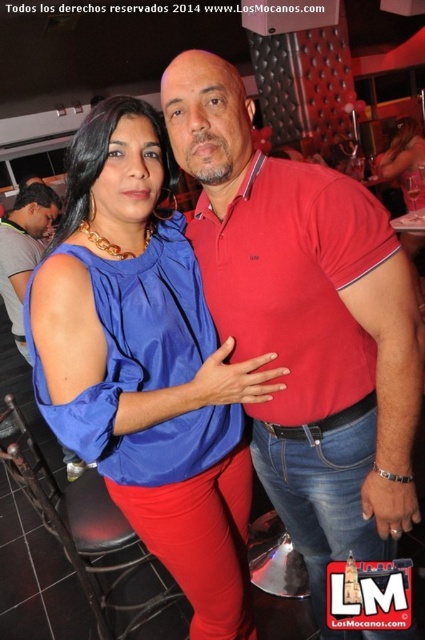
Question: Which point appears closest to the camera in this image?

Choices:
 (A) pyautogui.click(x=274, y=179)
 (B) pyautogui.click(x=192, y=525)
 (C) pyautogui.click(x=17, y=326)

Answer: (A)

Question: Can you confirm if red cotton polo shirt at center is bigger than blue satin blouse at center?

Choices:
 (A) yes
 (B) no

Answer: (A)

Question: Which of these objects is positioned closest to the gray fabric shirt at left?

Choices:
 (A) blue satin blouse at center
 (B) matte blue shirt at center
 (C) red cotton polo shirt at center

Answer: (B)

Question: Can you confirm if blue satin blouse at center is positioned to the left of matte blue shirt at center?

Choices:
 (A) yes
 (B) no

Answer: (B)

Question: Which of these objects is positioned closest to the matte blue shirt at center?

Choices:
 (A) red cotton polo shirt at center
 (B) blue satin blouse at center

Answer: (B)

Question: Is blue satin blouse at center further to the viewer compared to matte blue shirt at center?

Choices:
 (A) yes
 (B) no

Answer: (B)